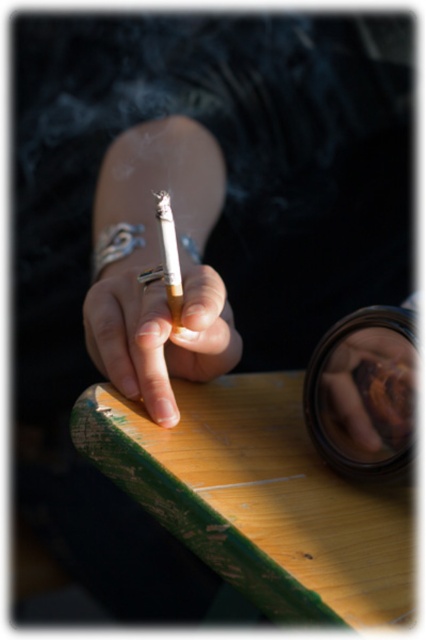
Does matte yellow wood at center have a lesser height compared to matte brown cigarette at center?

No.

Where is `matte yellow wood at center`? This screenshot has height=640, width=426. matte yellow wood at center is located at coordinates (158, 332).

This screenshot has width=426, height=640. I want to click on matte yellow wood at center, so click(158, 332).